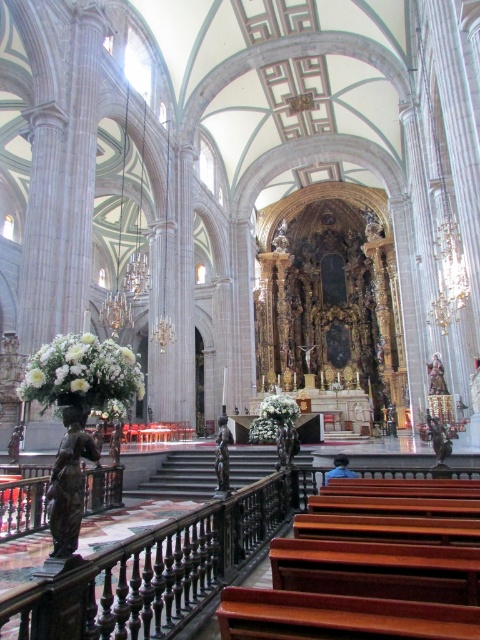
Is point (84, 403) closer to viewer compared to point (280, 410)?

Yes.

Can you confirm if white floral arrangement at left is taller than white matte flowers at center?

Incorrect, white floral arrangement at left's height is not larger of white matte flowers at center's.

You are a GUI agent. You are given a task and a screenshot of the screen. Output one action in this format:
    pyautogui.click(x=<x>, y=<y>)
    Task: Click on the white floral arrangement at left
    
    Given the screenshot: What is the action you would take?
    (84, 374)

Is the position of white matte floral arrangement at left more distant than that of white matte flower at center?

Yes, it is behind white matte flower at center.

Who is positioned more to the left, white matte floral arrangement at left or white matte flower at center?

Positioned to the left is white matte floral arrangement at left.

Does point (36, 387) lie in front of point (82, 380)?

No, (36, 387) is behind (82, 380).

At what (x,y) coordinates should I click in order to perform the action: click on white matte floral arrangement at left. Please return your answer as a coordinate pair (x, y). This screenshot has width=480, height=640. Looking at the image, I should click on pos(35,378).

Who is positioned more to the left, white matte flowers at center or white matte floral arrangement at left?

From the viewer's perspective, white matte floral arrangement at left appears more on the left side.

Which of these two, white matte flowers at center or white matte floral arrangement at left, stands taller?

Standing taller between the two is white matte flowers at center.

Image resolution: width=480 pixels, height=640 pixels. What do you see at coordinates (278, 406) in the screenshot?
I see `white matte flowers at center` at bounding box center [278, 406].

What are the coordinates of `white matte flowers at center` in the screenshot? It's located at (278, 406).